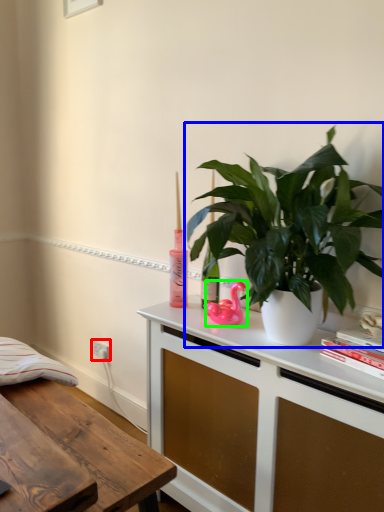
Question: Which is farther away from electric outlet (highlighted by a red box)? houseplant (highlighted by a blue box) or appliance (highlighted by a green box)?

Choices:
 (A) houseplant
 (B) appliance

Answer: (A)